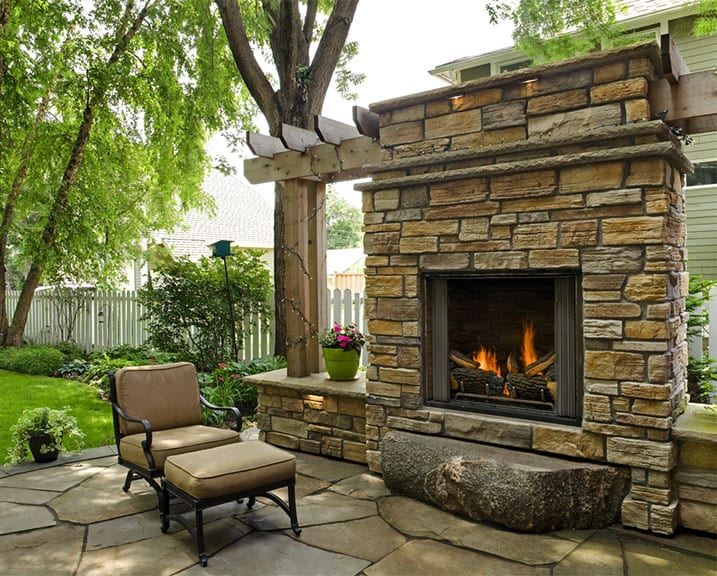
This screenshot has height=576, width=717. Identify the location of chair. (148, 400).